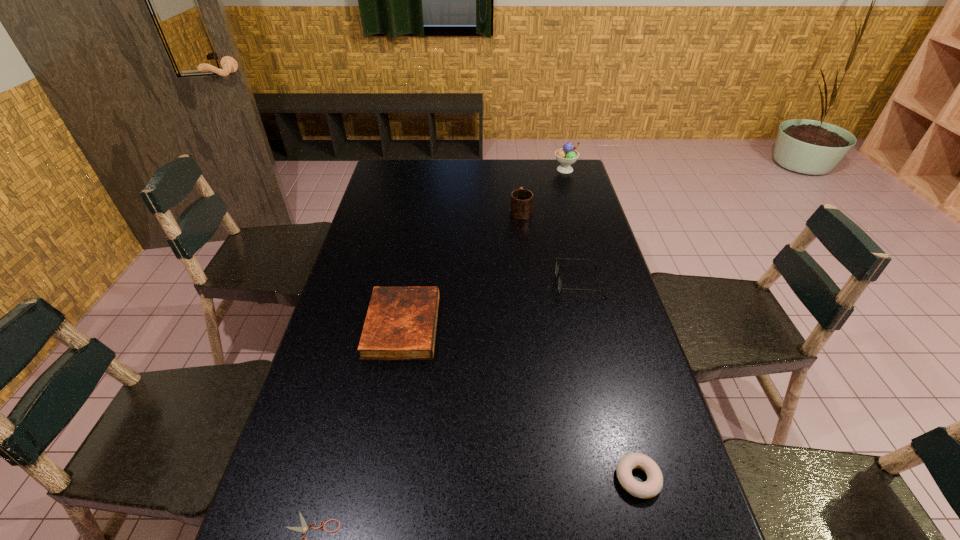
I want to click on icecream, so click(x=566, y=156).

Where is `the farthest object`? This screenshot has height=540, width=960. the farthest object is located at coordinates (566, 156).

Locate an element on the screen. The width and height of the screenshot is (960, 540). mug is located at coordinates (521, 199).

The height and width of the screenshot is (540, 960). I want to click on the second farthest object, so click(521, 199).

You are a GUI agent. You are given a task and a screenshot of the screen. Output one action in this format:
    pyautogui.click(x=<x>, y=<y>)
    Task: Click on the spectacles
    
    Given the screenshot: What is the action you would take?
    pyautogui.click(x=560, y=289)

This screenshot has height=540, width=960. In order to click on Bible in this screenshot , I will do `click(400, 324)`.

The image size is (960, 540). Find the location of `the fifth farthest object`. the fifth farthest object is located at coordinates (652, 486).

Where is `doughnut`? Image resolution: width=960 pixels, height=540 pixels. doughnut is located at coordinates (652, 486).

Locate an element on the screen. This screenshot has width=960, height=540. vacant space located on the front of the tallest object is located at coordinates (575, 204).

The width and height of the screenshot is (960, 540). I want to click on free space located on the side of the fifth shortest object with the handle, so click(x=516, y=167).